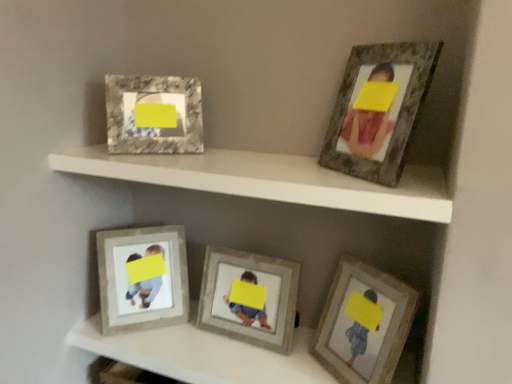
Question: From the image's perspective, is marble-like frame at upper left, arranged as the fourth picture frame when viewed from the right, above or below rustic wood frame at upper right, the 1th picture frame viewed from the right?

Choices:
 (A) above
 (B) below

Answer: (A)

Question: Is marble-like frame at upper left, arranged as the fourth picture frame when viewed from the right, to the left or to the right of rustic wood frame at upper right, the 5th picture frame when ordered from left to right, in the image?

Choices:
 (A) left
 (B) right

Answer: (A)

Question: Which of these objects is positioned farthest from the marble-like frame at upper left, arranged as the fourth picture frame when viewed from the right?

Choices:
 (A) rustic wood frame at upper right, the 1th picture frame viewed from the right
 (B) wooden textured frame at lower left, arranged as the first picture frame when viewed from the left
 (C) matte gray frame at center, arranged as the third picture frame when viewed from the right
 (D) wooden photo frame at lower right, which is the fourth picture frame from left to right
 (E) matte gray frame at upper center

Answer: (D)

Question: Estimate the real-world distances between objects in this image. Which object is farther from the rustic wood frame at upper right, the 1th picture frame viewed from the right?

Choices:
 (A) wooden textured frame at lower left, the 5th picture frame in the right-to-left sequence
 (B) matte gray frame at upper center
 (C) marble-like frame at upper left, positioned as the 2th picture frame in left-to-right order
 (D) wooden photo frame at lower right, which is the fourth picture frame from left to right
 (E) matte gray frame at center, arranged as the third picture frame when viewed from the right

Answer: (A)